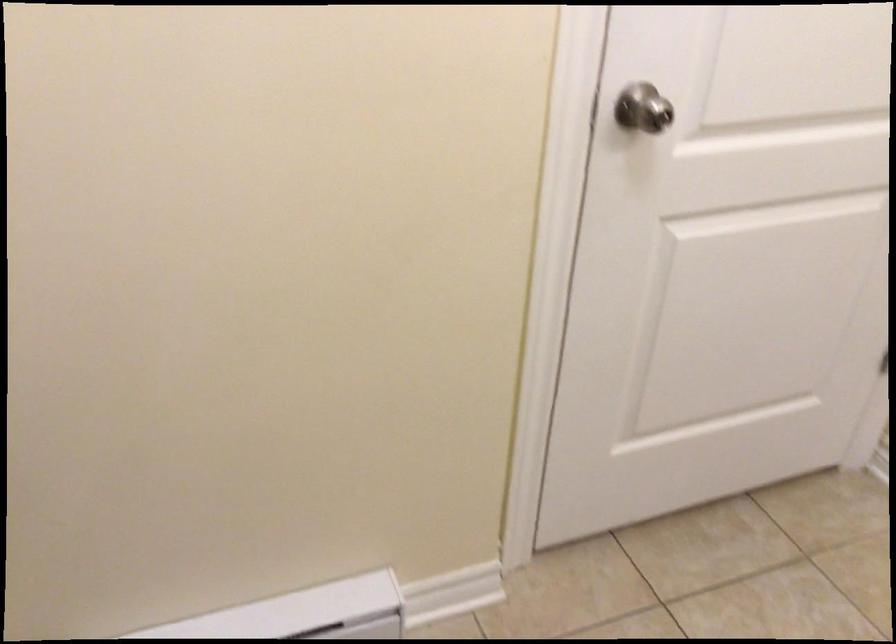
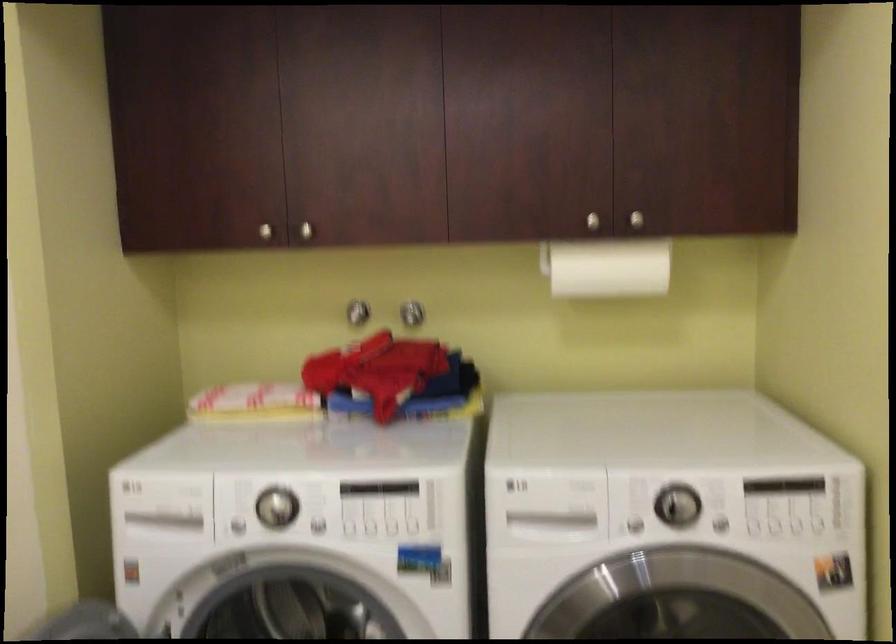
First-person continuous shooting, in which direction is the camera rotating?

The camera's rotation is toward left-down.